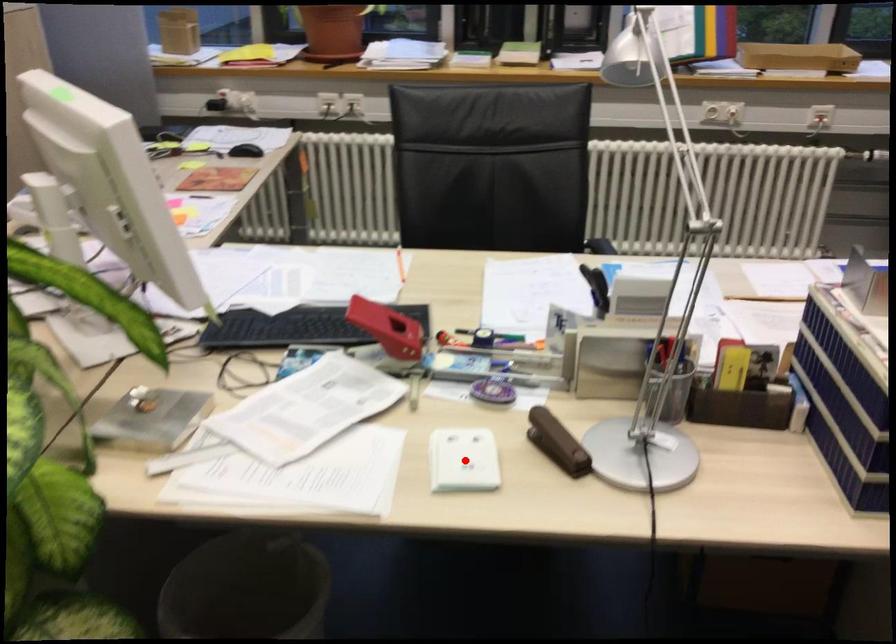
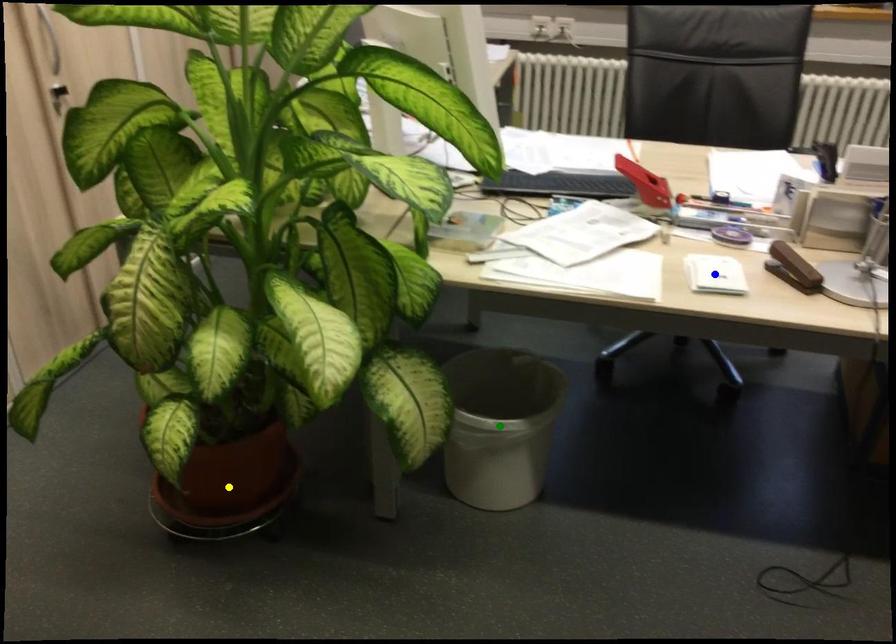
Question: I am providing you with two images of the same scene from different viewpoints. A red point is marked on the first image. You are given multiple points on the second image. Which point in image 2 is actually the same real-world point as the red point in image 1?

Choices:
 (A) green point
 (B) blue point
 (C) yellow point

Answer: (B)